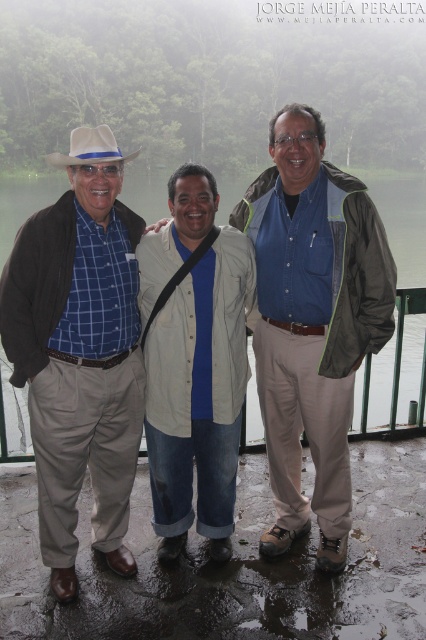
Question: Does blue plaid shirt at left have a greater width compared to white felt cowboy hat at upper left?

Choices:
 (A) yes
 (B) no

Answer: (B)

Question: Does matte blue plaid shirt at center have a smaller size compared to blue plaid shirt at left?

Choices:
 (A) yes
 (B) no

Answer: (B)

Question: Can you confirm if matte blue plaid shirt at center is bigger than blue plaid shirt at left?

Choices:
 (A) no
 (B) yes

Answer: (B)

Question: Which object is the farthest from the beige cotton shirt at center?

Choices:
 (A) white felt cowboy hat at upper left
 (B) blue denim shirt at center
 (C) blue plaid shirt at left

Answer: (A)

Question: Which of these objects is positioned farthest from the blue denim shirt at center?

Choices:
 (A) matte blue plaid shirt at center
 (B) beige cotton shirt at center
 (C) white felt cowboy hat at upper left

Answer: (C)

Question: Which point is farther to the camera?

Choices:
 (A) white felt cowboy hat at upper left
 (B) beige cotton shirt at center

Answer: (B)